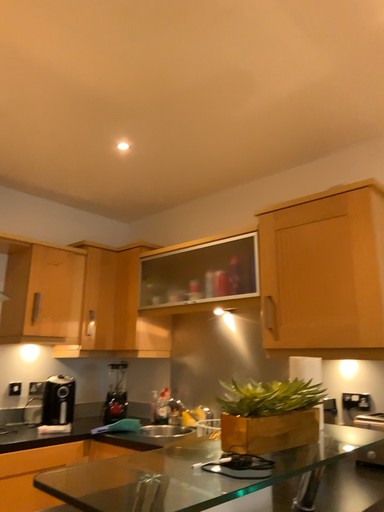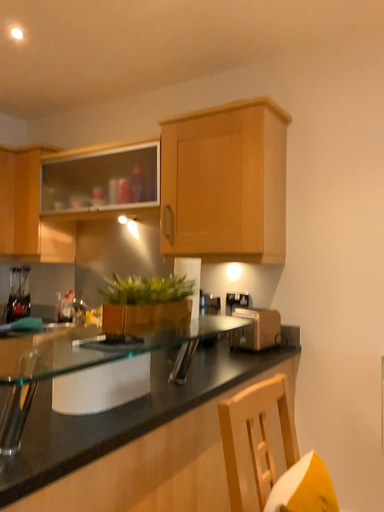
Question: Which way did the camera rotate in the video?

Choices:
 (A) rotated right
 (B) rotated left

Answer: (A)